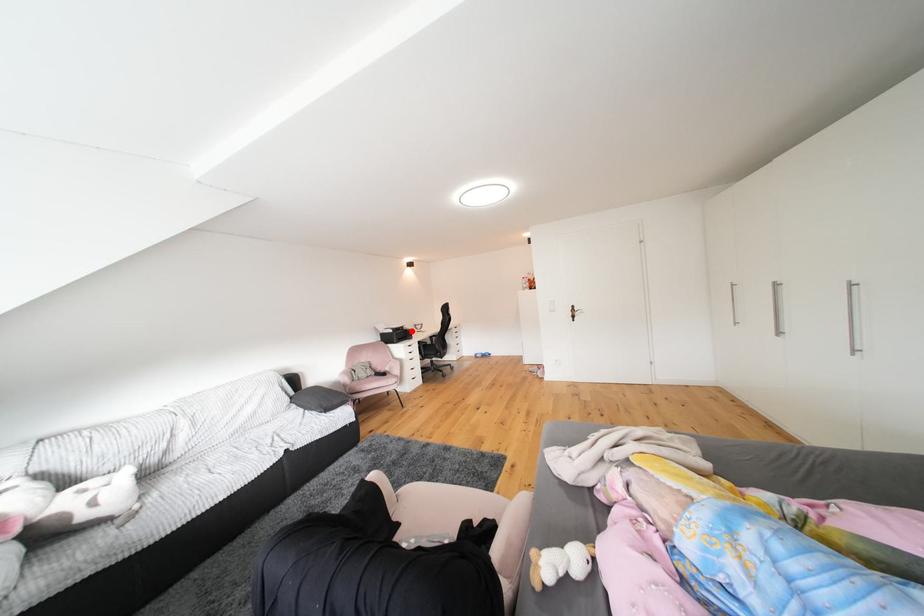
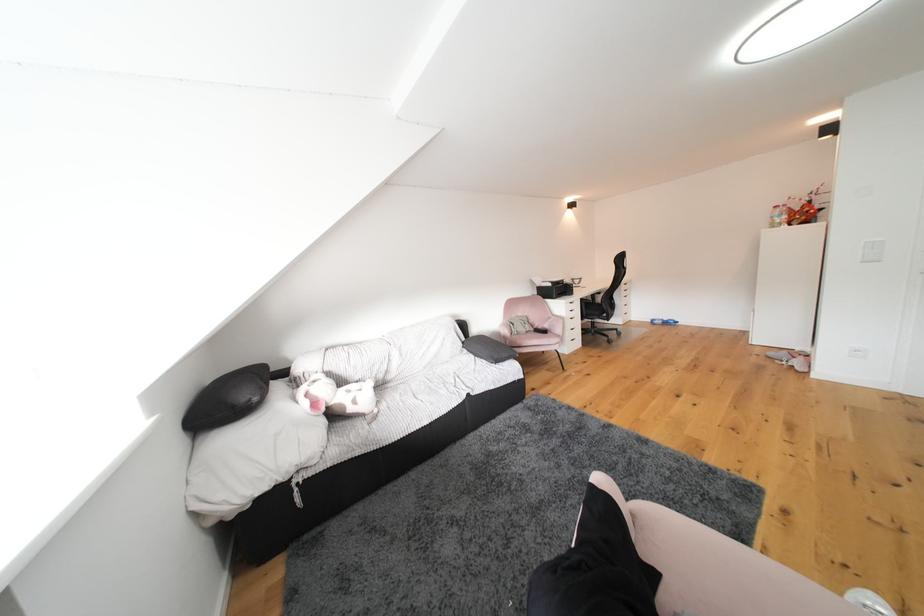
Where in the second image is the point corresponding to the highlighted location from the first image?

(572, 285)